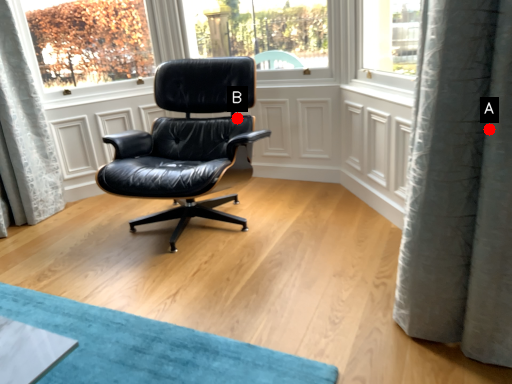
Question: Two points are circled on the image, labeled by A and B beside each circle. Which point appears closest to the camera in this image?

Choices:
 (A) A is closer
 (B) B is closer

Answer: (A)